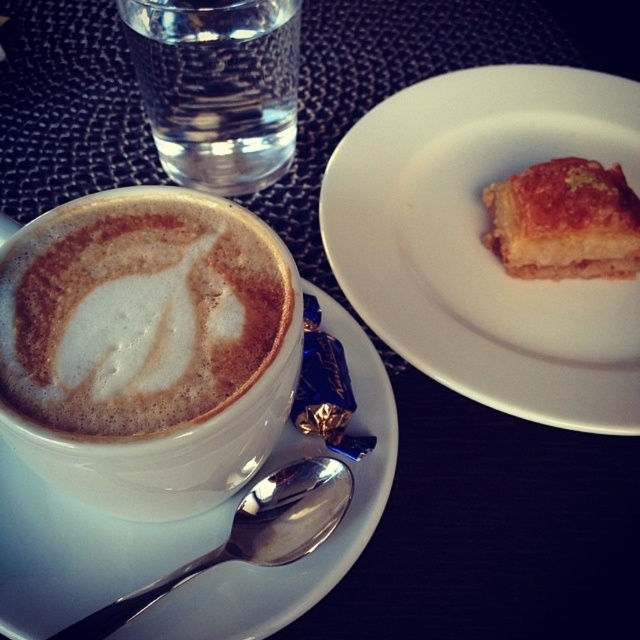
You are a customer at the cafe and want to pick up the golden brown flaky pastry at upper right. Will you need to move the silver metallic spoon at lower left to reach it?

The silver metallic spoon at lower left is behind the golden brown flaky pastry at upper right, so you don t need to move the spoon to reach the pastry.

You are a customer sitting at the table and want to reach both the golden brown flaky pastry at upper right and the cappuccino. Which item is closer to you?

The golden brown flaky pastry at upper right is closer to you since it is only 10.50 inches away from the viewer, while the cappuccino is farther away.

You are a customer at the cozy cafe and want to reach for the golden flaky pastry at upper right. Given that your hand is currently at position point (483, 244), which is where the pastry is located, can you safely grab it without knocking over the cappuccino in the white ceramic cup?

The point (483, 244) corresponds to the golden flaky pastry at upper right, so you can safely grab it without knocking over the cappuccino in the white ceramic cup since they are at the same location.